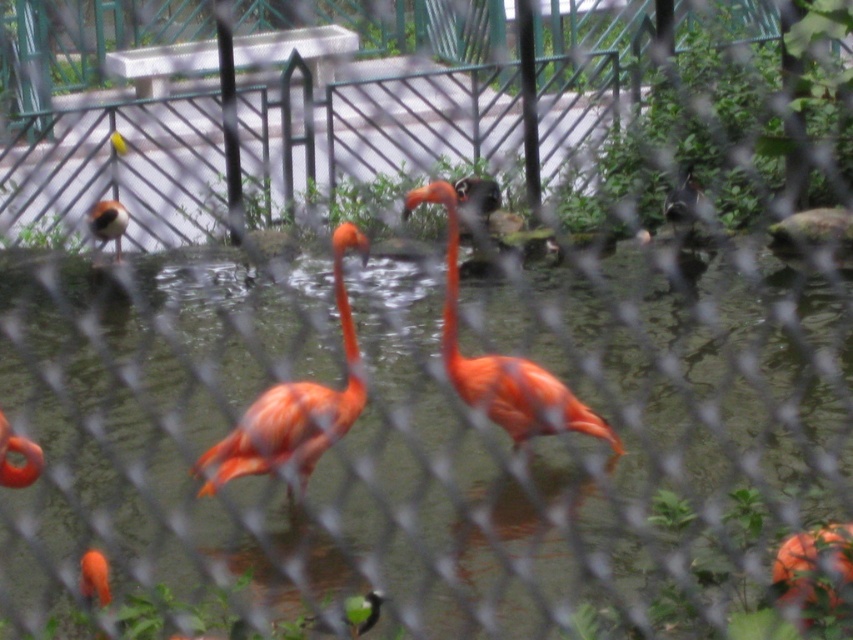
Who is lower down, orange matte flamingo at center or brown speckled bird at upper left?

orange matte flamingo at center is below.

Is orange matte flamingo at center further to the viewer compared to brown speckled bird at upper left?

No, orange matte flamingo at center is closer to the viewer.

Describe the element at coordinates (294, 403) in the screenshot. This screenshot has height=640, width=853. I see `orange matte flamingo at center` at that location.

Identify the location of orange matte flamingo at center. This screenshot has width=853, height=640. (294, 403).

Which is behind, point (634, 33) or point (299, 456)?

The point (634, 33) is more distant.

Which is in front, point (485, 83) or point (321, 390)?

Point (321, 390) is more forward.

Locate an element on the screen. Image resolution: width=853 pixels, height=640 pixels. metal chain-link fence at center is located at coordinates (329, 109).

Between metal chain-link fence at center and matte orange flamingo at center, which one appears on the left side from the viewer's perspective?

From the viewer's perspective, matte orange flamingo at center appears more on the left side.

Locate an element on the screen. Image resolution: width=853 pixels, height=640 pixels. metal chain-link fence at center is located at coordinates (329, 109).

Identify the location of metal chain-link fence at center. The height and width of the screenshot is (640, 853). point(329,109).